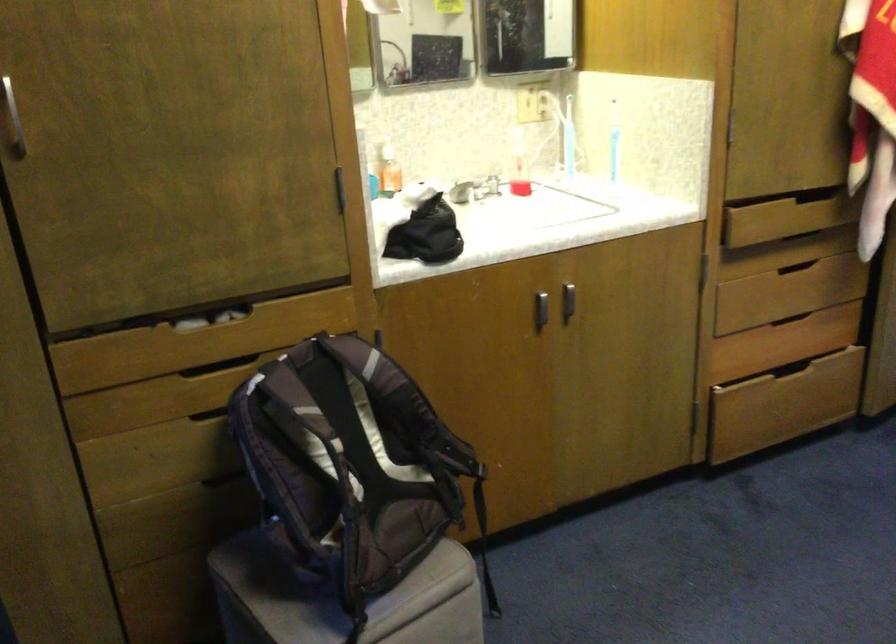
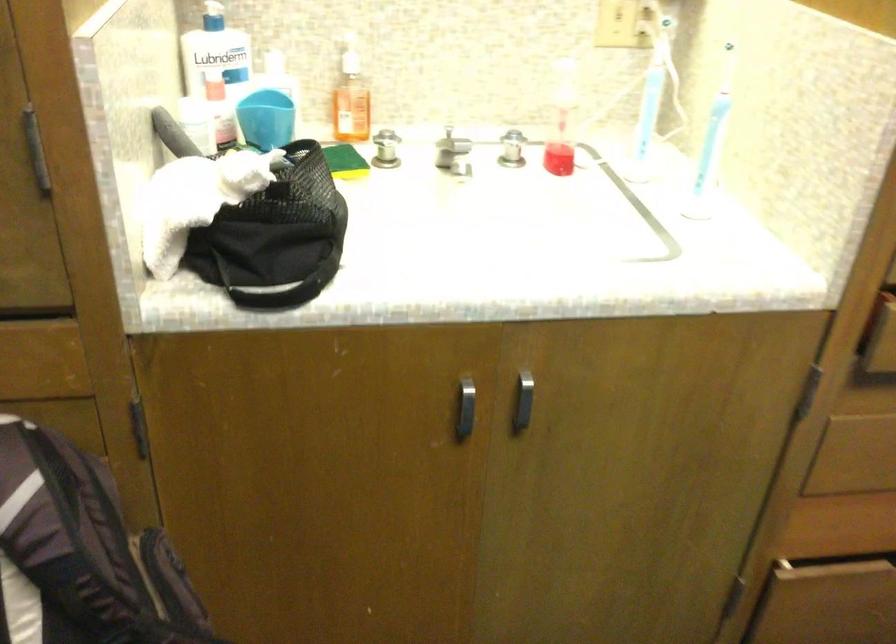
Where in the second image is the point corresponding to point (435, 252) from the first image?

(279, 286)